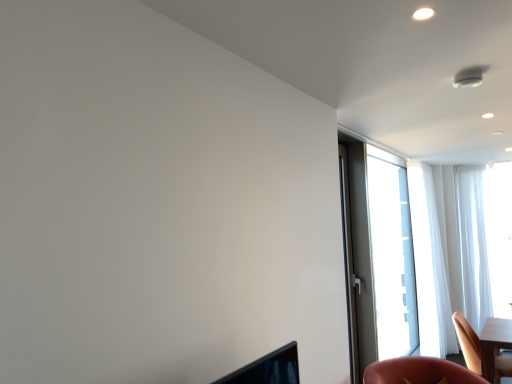
Question: Considering their positions, is white sheer curtain at right, positioned as the second curtain in left-to-right order, located in front of or behind wooden chair at lower right?

Choices:
 (A) front
 (B) behind

Answer: (B)

Question: From the image's perspective, is white sheer curtain at right, which is counted as the 1th curtain, starting from the right, located above or below wooden chair at lower right?

Choices:
 (A) below
 (B) above

Answer: (B)

Question: Which object is positioned closest to the white sheer curtain at right, arranged as the first curtain when viewed from the left?

Choices:
 (A) matte gray screen door at right
 (B) wooden chair at lower right
 (C) transparent glass window at right
 (D) white sheer curtain at right, which is counted as the 1th curtain, starting from the right

Answer: (D)

Question: Which object is positioned closest to the white sheer curtain at right, positioned as the second curtain in left-to-right order?

Choices:
 (A) white sheer curtain at right, which is the second curtain in right-to-left order
 (B) matte gray screen door at right
 (C) transparent glass window at right
 (D) wooden chair at lower right

Answer: (A)